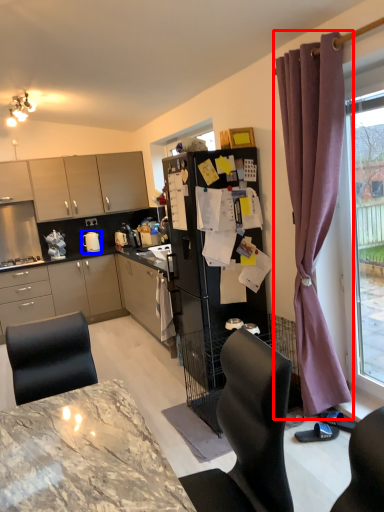
Question: Which of the following is the closest to the observer, curtain (highlighted by a red box) or appliance (highlighted by a blue box)?

Choices:
 (A) curtain
 (B) appliance

Answer: (A)